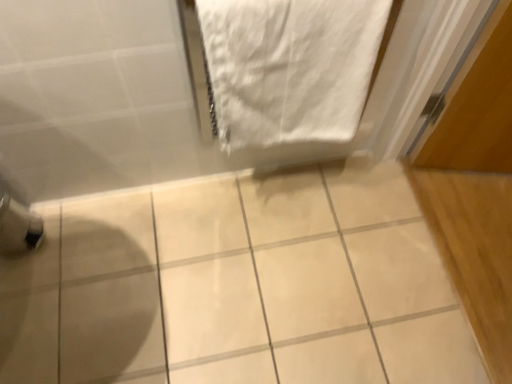
Where is `white glossy tile at center`? This screenshot has width=512, height=384. white glossy tile at center is located at coordinates (237, 286).

Describe the element at coordinates (237, 286) in the screenshot. This screenshot has width=512, height=384. I see `white glossy tile at center` at that location.

Measure the distance between white cotton towel at upper right and camera.

The distance of white cotton towel at upper right from camera is 31.37 inches.

The image size is (512, 384). What do you see at coordinates (289, 67) in the screenshot?
I see `white cotton towel at upper right` at bounding box center [289, 67].

At what (x,y) coordinates should I click in order to perform the action: click on white cotton towel at upper right. Please return your answer as a coordinate pair (x, y). The height and width of the screenshot is (384, 512). Looking at the image, I should click on [289, 67].

What are the coordinates of `white glossy tile at center` in the screenshot? It's located at (237, 286).

Which object is positioned more to the left, white cotton towel at upper right or white glossy tile at center?

Positioned to the left is white glossy tile at center.

Is the position of white cotton towel at upper right more distant than that of white glossy tile at center?

No.

Which is nearer, (365, 50) or (151, 201)?

Point (365, 50) is positioned closer to the camera compared to point (151, 201).

From the image's perspective, is white cotton towel at upper right above or below white glossy tile at center?

From the image's perspective, white cotton towel at upper right appears above white glossy tile at center.

From a real-world perspective, is white cotton towel at upper right below white glossy tile at center?

Actually, white cotton towel at upper right is physically above white glossy tile at center in the real world.

Considering the sizes of white cotton towel at upper right and white glossy tile at center in the image, is white cotton towel at upper right wider or thinner than white glossy tile at center?

In the image, white cotton towel at upper right appears to be more narrow than white glossy tile at center.

In terms of height, does white cotton towel at upper right look taller or shorter compared to white glossy tile at center?

Clearly, white cotton towel at upper right is taller compared to white glossy tile at center.

Considering the relative sizes of white cotton towel at upper right and white glossy tile at center in the image provided, is white cotton towel at upper right smaller than white glossy tile at center?

Correct, white cotton towel at upper right occupies less space than white glossy tile at center.

Is white cotton towel at upper right inside the boundaries of white glossy tile at center, or outside?

white cotton towel at upper right is spatially situated outside white glossy tile at center.

Are white cotton towel at upper right and white glossy tile at center making contact?

No, white cotton towel at upper right is not next to white glossy tile at center.

Is white cotton towel at upper right turned away from white glossy tile at center?

No, white cotton towel at upper right's orientation is not away from white glossy tile at center.

Measure the distance from white cotton towel at upper right to white glossy tile at center.

white cotton towel at upper right and white glossy tile at center are 21.78 inches apart from each other.

Identify the location of towel to the right of white glossy tile at center. This screenshot has width=512, height=384. (289, 67).

Which object is positioned more to the right, white glossy tile at center or white cotton towel at upper right?

From the viewer's perspective, white cotton towel at upper right appears more on the right side.

Based on the photo, in the image, is white glossy tile at center positioned in front of or behind white cotton towel at upper right?

Clearly, white glossy tile at center is behind white cotton towel at upper right.

Which point is more distant from viewer, (480, 381) or (356, 78)?

The point (480, 381) is farther from the camera.

From the image's perspective, is white glossy tile at center over white cotton towel at upper right?

No.

From a real-world perspective, which object stands above the other?

white cotton towel at upper right is physically above.

Can you confirm if white glossy tile at center is thinner than white cotton towel at upper right?

In fact, white glossy tile at center might be wider than white cotton towel at upper right.

Does white glossy tile at center have a lesser height compared to white cotton towel at upper right?

Indeed, white glossy tile at center has a lesser height compared to white cotton towel at upper right.

Does white glossy tile at center have a larger size compared to white cotton towel at upper right?

Yes.

Is white glossy tile at center outside of white cotton towel at upper right?

white glossy tile at center lies outside white cotton towel at upper right's area.

Would you say white glossy tile at center is a long distance from white cotton towel at upper right?

No, there isn't a large distance between white glossy tile at center and white cotton towel at upper right.

Is white glossy tile at center oriented towards white cotton towel at upper right?

No, white glossy tile at center is not aimed at white cotton towel at upper right.

Find the location of a particular element. This screenshot has height=384, width=512. towel above the white glossy tile at center (from a real-world perspective) is located at coordinates (289, 67).

At what (x,y) coordinates should I click in order to perform the action: click on towel on the right of white glossy tile at center. Please return your answer as a coordinate pair (x, y). The height and width of the screenshot is (384, 512). Looking at the image, I should click on (289, 67).

This screenshot has height=384, width=512. Find the location of `towel in front of the white glossy tile at center`. towel in front of the white glossy tile at center is located at coordinates (289, 67).